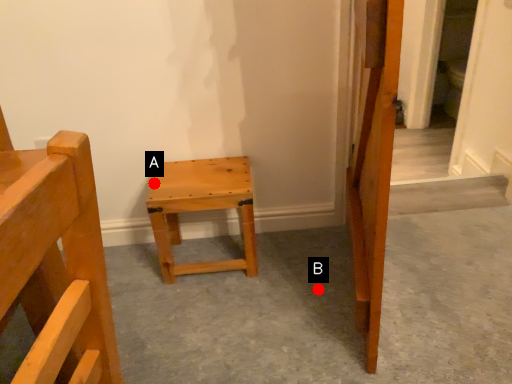
Question: Two points are circled on the image, labeled by A and B beside each circle. Among these points, which one is farthest from the camera?

Choices:
 (A) A is further
 (B) B is further

Answer: (B)